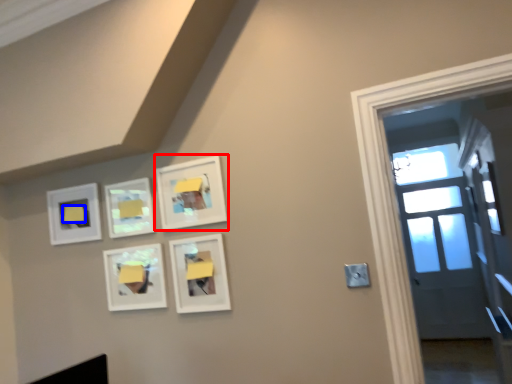
Question: Which object appears farthest to the camera in this image, picture frame (highlighted by a red box) or lift (highlighted by a blue box)?

Choices:
 (A) picture frame
 (B) lift

Answer: (B)